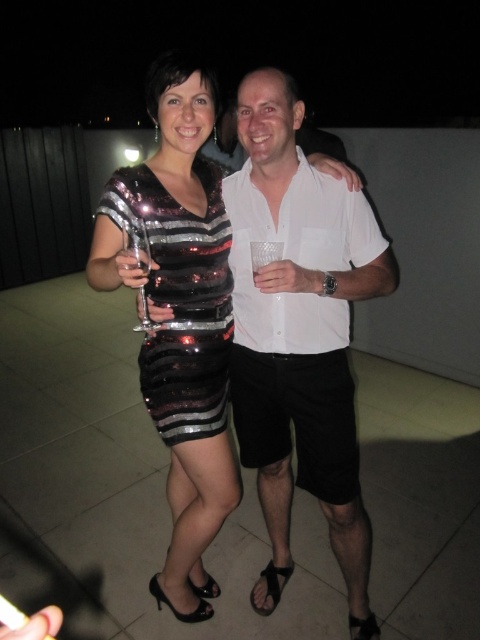
Question: Is sparkly sequined dress at center to the left of sequined black dress at center from the viewer's perspective?

Choices:
 (A) yes
 (B) no

Answer: (A)

Question: Which is nearer to the white matte shirt at center?

Choices:
 (A) clear glass wine glass at center
 (B) sequined black dress at center
 (C) sparkly sequined dress at center

Answer: (C)

Question: Does sequined black dress at center appear over clear glass wine glass at center?

Choices:
 (A) yes
 (B) no

Answer: (B)

Question: Among these objects, which one is nearest to the camera?

Choices:
 (A) sequined black dress at center
 (B) clear glass wine glass at center

Answer: (B)

Question: Which point is farther to the camera?

Choices:
 (A) (367, 557)
 (B) (124, 234)

Answer: (A)

Question: Is sparkly sequined dress at center in front of clear glass wine glass at center?

Choices:
 (A) no
 (B) yes

Answer: (A)